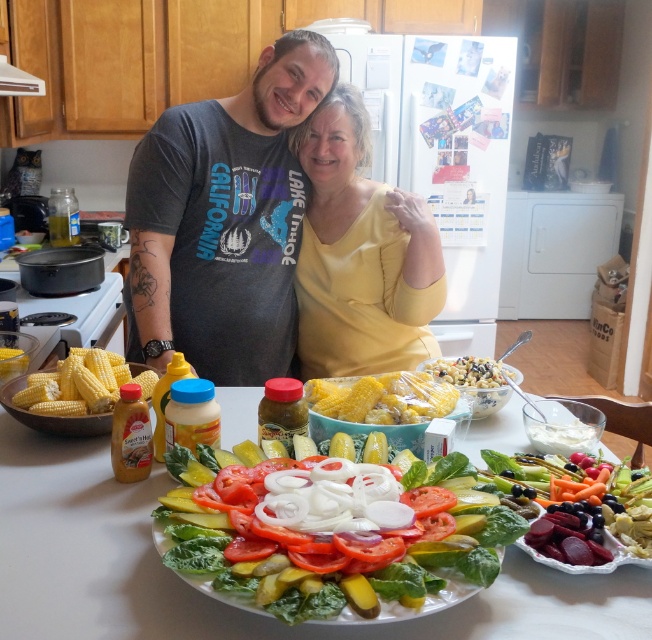
Can you confirm if white ceramic plate at center is smaller than fresh green salad at center?

Incorrect, white ceramic plate at center is not smaller in size than fresh green salad at center.

Describe the element at coordinates (209, 598) in the screenshot. I see `white ceramic plate at center` at that location.

Find the location of `white ceramic plate at center`. white ceramic plate at center is located at coordinates (209, 598).

What do you see at coordinates (334, 540) in the screenshot? The image size is (652, 640). I see `fresh green salad at center` at bounding box center [334, 540].

Does fresh green salad at center come behind yellow matte shirt at center?

No, fresh green salad at center is closer to the viewer.

Between point (479, 570) and point (359, 300), which one is positioned behind?

The point (359, 300) is more distant.

Where is `fresh green salad at center`? This screenshot has width=652, height=640. fresh green salad at center is located at coordinates (334, 540).

Between yellow corn at center and yellow matte corn at left, which one is positioned lower?

Positioned lower is yellow corn at center.

The width and height of the screenshot is (652, 640). What do you see at coordinates (383, 397) in the screenshot? I see `yellow corn at center` at bounding box center [383, 397].

Locate an element on the screen. This screenshot has width=652, height=640. yellow corn at center is located at coordinates (383, 397).